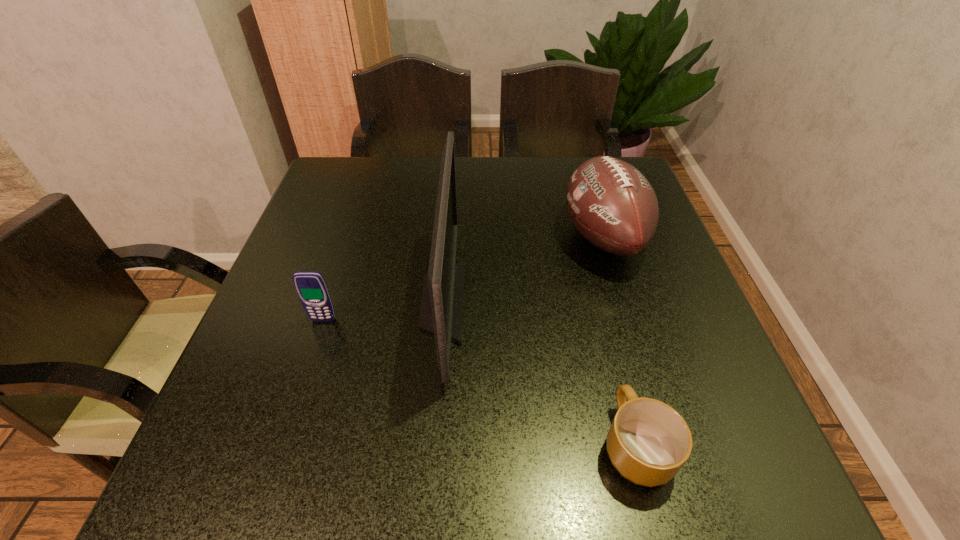
Find the location of a particular element. The image size is (960, 540). the second object from left to right is located at coordinates (441, 312).

Where is `the tallest object`? The image size is (960, 540). the tallest object is located at coordinates pyautogui.click(x=441, y=312).

Where is `football (American)`? football (American) is located at coordinates [614, 207].

Find the location of a particular element. The height and width of the screenshot is (540, 960). cellular telephone is located at coordinates (311, 287).

What are the coordinates of `the third tallest object` in the screenshot? It's located at (311, 287).

Where is `the nearest object`? the nearest object is located at coordinates (648, 442).

Identify the location of mug. The width and height of the screenshot is (960, 540). (648, 442).

This screenshot has height=540, width=960. I want to click on free space located 0.150m on the screen side of the tallest object, so click(x=534, y=302).

At what (x,y) coordinates should I click in order to perform the action: click on free space located 0.160m on the back of the football (American). Please return your answer as a coordinate pair (x, y). The width and height of the screenshot is (960, 540). Looking at the image, I should click on [x=582, y=169].

The width and height of the screenshot is (960, 540). Identify the location of free space located on the front-facing side of the cellular telephone. tap(275, 471).